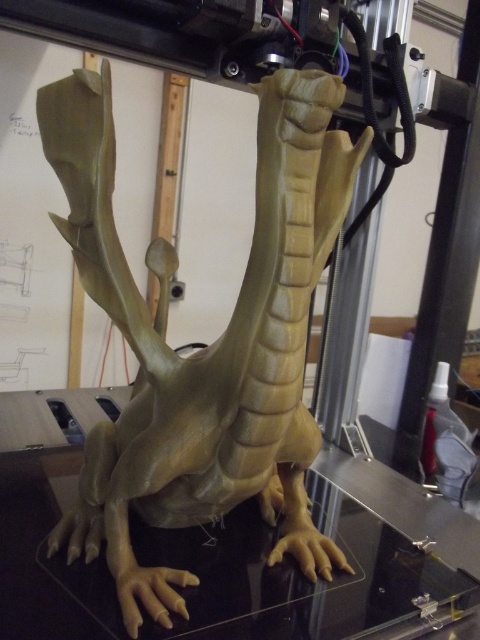
Image resolution: width=480 pixels, height=640 pixels. What do you see at coordinates (206, 346) in the screenshot?
I see `matte yellow dinosaur at center` at bounding box center [206, 346].

Does matte yellow dinosaur at center appear on the right side of transparent glass table at center?

No, matte yellow dinosaur at center is not to the right of transparent glass table at center.

Measure the distance between point (184,518) and camera.

Point (184,518) and camera are 35.91 inches apart from each other.

Identify the location of matte yellow dinosaur at center. (206, 346).